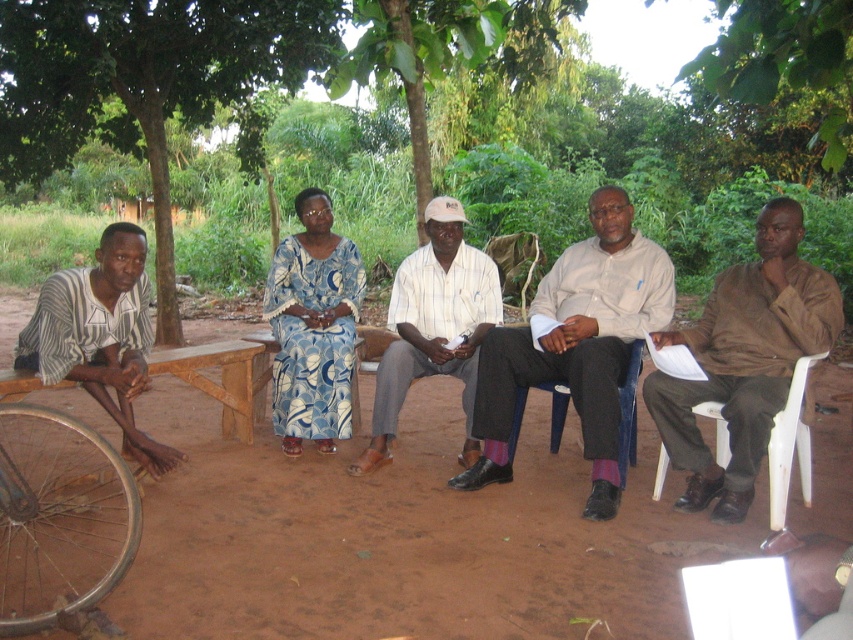
Can you confirm if brown dirt field at lower center is positioned above green leafy tree at upper left?

No, brown dirt field at lower center is not above green leafy tree at upper left.

Can you confirm if brown dirt field at lower center is positioned below green leafy tree at upper left?

Indeed, brown dirt field at lower center is positioned under green leafy tree at upper left.

This screenshot has height=640, width=853. Identify the location of brown dirt field at lower center. (404, 534).

Between point (447, 308) and point (788, 388), which one is positioned in front?

Point (788, 388) is more forward.

Between white striped shirt at center and white plastic chair at right, which one has more height?

Standing taller between the two is white striped shirt at center.

The height and width of the screenshot is (640, 853). I want to click on white striped shirt at center, so click(433, 326).

Can you confirm if green leafy tree at upper left is thinner than white plastic chair at right?

Incorrect, green leafy tree at upper left's width is not less than white plastic chair at right's.

Is point (28, 177) positioned behind point (701, 410)?

Yes, point (28, 177) is farther from viewer.

Identify the location of green leafy tree at upper left. (143, 81).